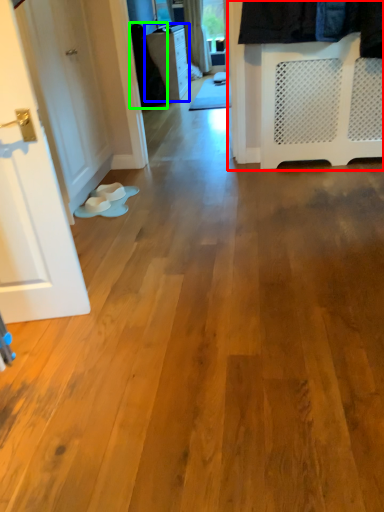
Question: Which object is positioned closest to closet (highlighted by a red box)? Select from furniture (highlighted by a blue box) and clothing (highlighted by a green box).

Choices:
 (A) furniture
 (B) clothing

Answer: (B)